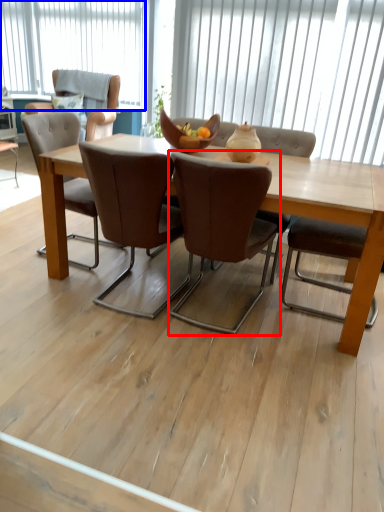
Question: Which object is closer to the camera taking this photo, chair (highlighted by a red box) or window (highlighted by a blue box)?

Choices:
 (A) chair
 (B) window

Answer: (A)